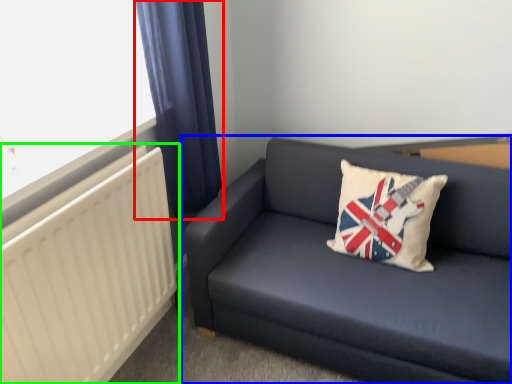
Question: Which object is positioned farthest from curtain (highlighted by a red box)? Select from studio couch (highlighted by a blue box) and radiator (highlighted by a green box).

Choices:
 (A) studio couch
 (B) radiator

Answer: (A)